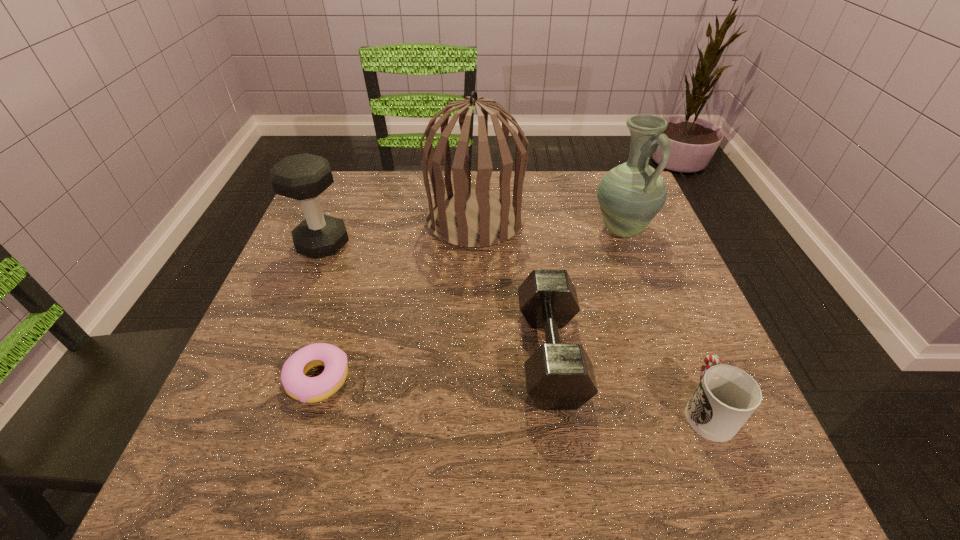
This screenshot has height=540, width=960. Identify the location of object that stands as the second closest to the second tallest object. (559, 376).

Locate an element on the screen. free space that satisfies the following two spatial constraints: 1. on the back side of the nearer dumbbell; 2. on the left side of the shortest object is located at coordinates (325, 354).

Find the location of `blank area in the image that satisfies the following two spatial constraints: 1. on the front side of the shorter dumbbell; 2. on the left side of the birdcage`. blank area in the image that satisfies the following two spatial constraints: 1. on the front side of the shorter dumbbell; 2. on the left side of the birdcage is located at coordinates (473, 354).